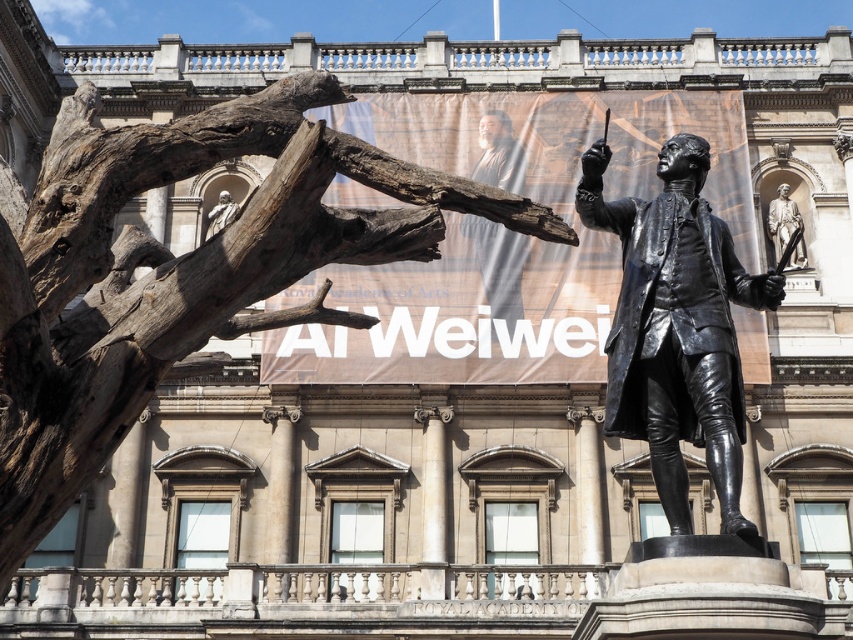
Question: Which object is farther from the camera taking this photo?

Choices:
 (A) brown rough wood at left
 (B) bronze statue at upper right

Answer: (B)

Question: Which of the following is the farthest from the observer?

Choices:
 (A) (500, 310)
 (B) (236, 291)

Answer: (A)

Question: Is brown rough wood at left positioned before bronze statue at center?

Choices:
 (A) no
 (B) yes

Answer: (B)

Question: Can you confirm if brown rough wood at left is positioned above bronze statue at upper right?

Choices:
 (A) no
 (B) yes

Answer: (A)

Question: Does brown rough wood at left appear on the right side of bronze statue at upper right?

Choices:
 (A) no
 (B) yes

Answer: (A)

Question: Which of the following is the closest to the observer?

Choices:
 (A) (688, 433)
 (B) (788, 240)
 (C) (297, 132)
 (D) (463, 220)

Answer: (C)